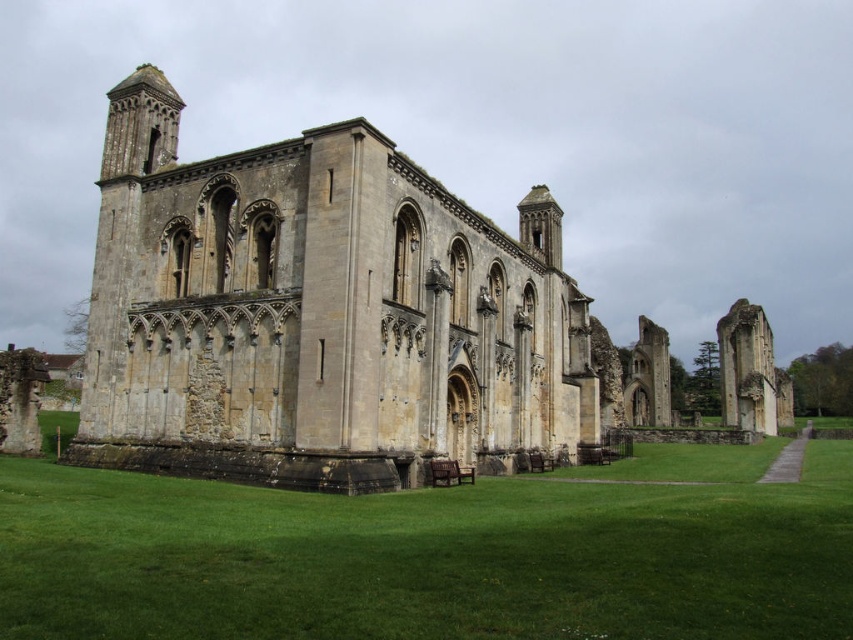
Question: Does yellow stone ruins at center have a smaller size compared to green grass at lower center?

Choices:
 (A) no
 (B) yes

Answer: (A)

Question: Where is yellow stone ruins at center located in relation to green grass at lower center in the image?

Choices:
 (A) right
 (B) left

Answer: (A)

Question: Among these points, which one is farthest from the camera?

Choices:
 (A) (292, 365)
 (B) (831, 627)

Answer: (A)

Question: Which point appears closest to the camera in this image?

Choices:
 (A) (346, 467)
 (B) (390, 636)

Answer: (B)

Question: Which point is farther to the camera?

Choices:
 (A) pyautogui.click(x=509, y=577)
 (B) pyautogui.click(x=523, y=216)

Answer: (B)

Question: Can you confirm if yellow stone ruins at center is positioned to the right of green grass at lower center?

Choices:
 (A) no
 (B) yes

Answer: (B)